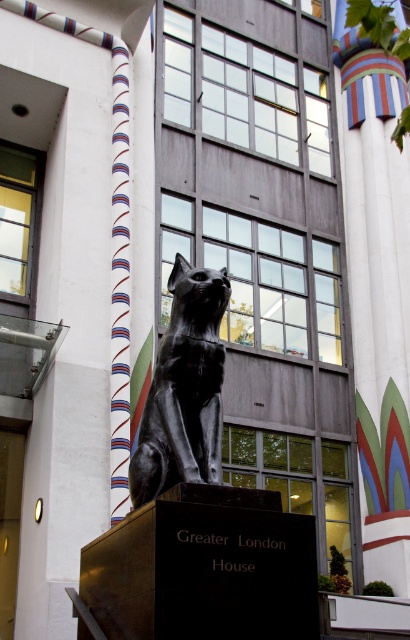
Does white striped pillar at center have a lesser width compared to black polished stone cat at center?

Incorrect, white striped pillar at center's width is not less than black polished stone cat at center's.

Between white striped pillar at center and black polished stone cat at center, which one is positioned lower?

Positioned lower is black polished stone cat at center.

Is point (382, 442) more distant than point (157, 365)?

Yes.

Where is `white striped pillar at center`? white striped pillar at center is located at coordinates (377, 292).